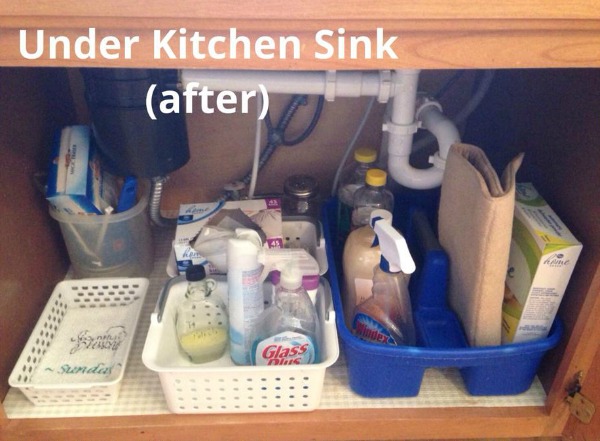
Identify the location of glass cleaner. (281, 339), (393, 320).